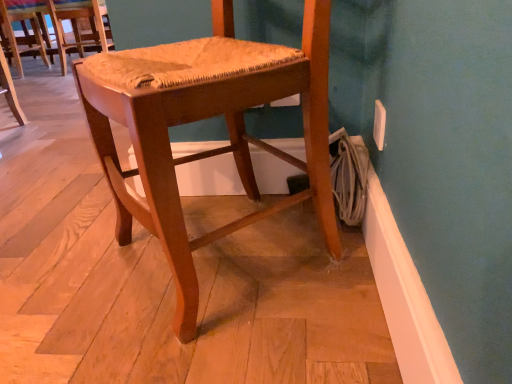
Identify the location of vacant point to the left of wooden woven seat at center, marked as the 1th chair in a front-to-back arrangement. (66, 274).